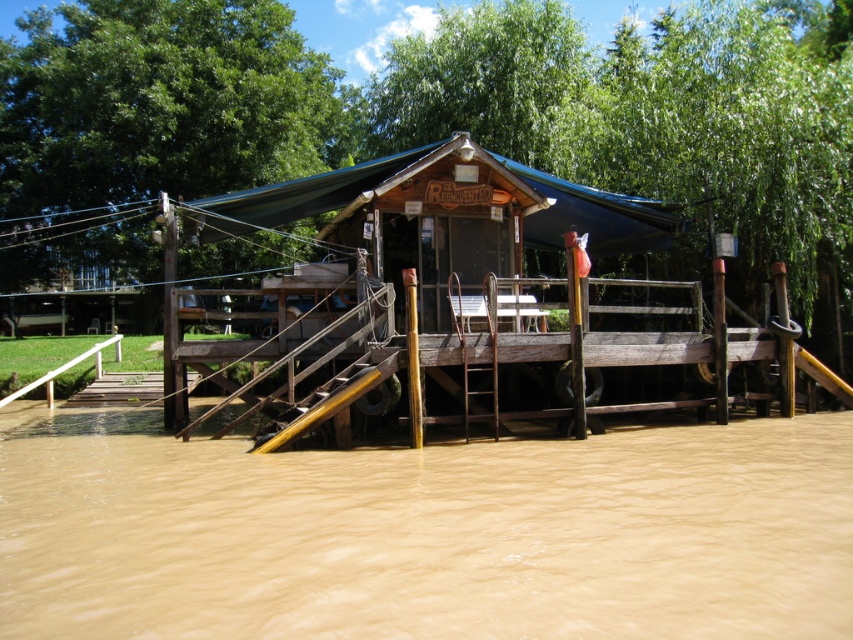
Question: Which point is closer to the camera?

Choices:
 (A) brown muddy water at lower center
 (B) blue tarpaulin canopy at center

Answer: (A)

Question: Which object is farther from the camera taking this photo?

Choices:
 (A) brown muddy water at lower center
 (B) blue tarpaulin canopy at center

Answer: (B)

Question: Can you confirm if brown muddy water at lower center is positioned to the right of blue tarpaulin canopy at center?

Choices:
 (A) yes
 (B) no

Answer: (A)

Question: Which of the following is the closest to the observer?

Choices:
 (A) (213, 230)
 (B) (196, 538)

Answer: (B)

Question: Is brown muddy water at lower center thinner than blue tarpaulin canopy at center?

Choices:
 (A) no
 (B) yes

Answer: (A)

Question: Is brown muddy water at lower center to the left of blue tarpaulin canopy at center from the viewer's perspective?

Choices:
 (A) no
 (B) yes

Answer: (A)